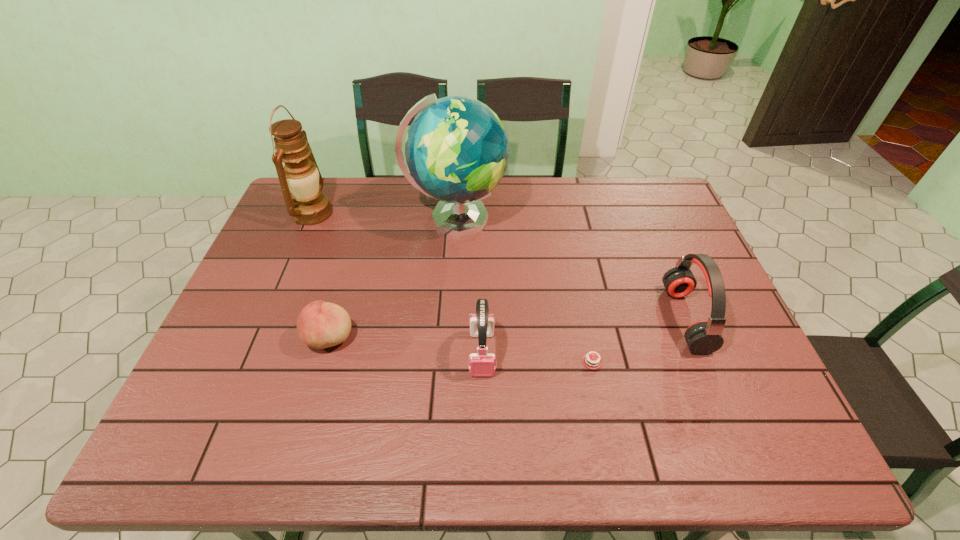
Locate an element on the screen. The width and height of the screenshot is (960, 540). vacant space located 0.120m on the ear cups of the rightmost object is located at coordinates (624, 319).

This screenshot has width=960, height=540. Identify the location of free region located on the ear cups of the rightmost object. (639, 319).

The width and height of the screenshot is (960, 540). What are the coordinates of `vacant space positioned on the ear cups of the rightmost object` in the screenshot? It's located at (542, 319).

Where is `free region located on the outer surface of the left earphone`? This screenshot has height=540, width=960. free region located on the outer surface of the left earphone is located at coordinates (483, 432).

You are a GUI agent. You are given a task and a screenshot of the screen. Output one action in this format:
    pyautogui.click(x=<x>, y=<y>)
    Task: Click on the vacant space located 0.110m on the back of the second object from left to right
    This screenshot has width=960, height=540.
    Given the screenshot: What is the action you would take?
    pyautogui.click(x=345, y=288)

Where is `vacant space located on the left of the shortest object`? vacant space located on the left of the shortest object is located at coordinates (411, 361).

Locate an element on the screen. globe located in the far edge section of the desktop is located at coordinates point(457,150).

Where is `oil lamp at the far edge`? The height and width of the screenshot is (540, 960). oil lamp at the far edge is located at coordinates (308, 206).

Find the location of a particular element. This screenshot has width=960, height=540. object positioned at the left edge is located at coordinates (308, 206).

This screenshot has width=960, height=540. In order to click on object at the right edge in this screenshot , I will do `click(703, 337)`.